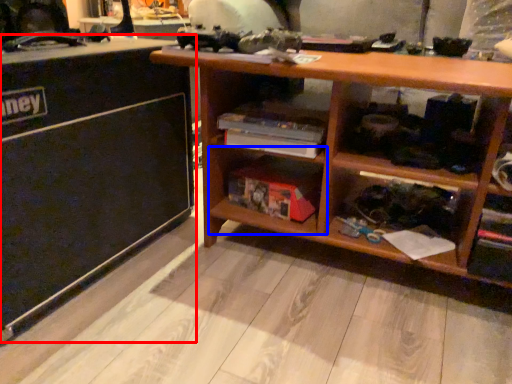
Question: Among these objects, which one is farthest to the camera, table (highlighted by a red box) or shelf (highlighted by a blue box)?

Choices:
 (A) table
 (B) shelf

Answer: (B)